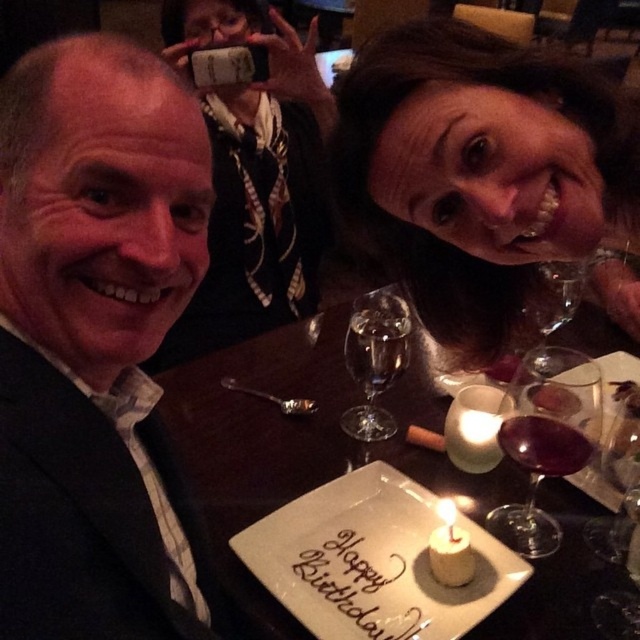
You are a waiter holding a tray of drinks. You need to place a new wine glass between the matte black suit at left and the translucent glass wine glass at center. Can you fit it there without moving the existing glass?

The distance between the matte black suit at left and the translucent glass wine glass at center is 42.97 centimeters. Assuming the new wine glass has a standard size of about 8 centimeters in diameter, there is sufficient space to place it between them without moving the existing glass.

You are a waiter in a restaurant. You need to serve a customer who ordered a drink in a glass with a larger width. Which glass should you choose between the dark red glass at center and the clear glass wine glass at upper right?

The clear glass wine glass at upper right has a larger width than the dark red glass at center, so you should choose the clear glass wine glass at upper right to serve the customer.

You are a waiter at this restaurant and need to place a dessert menu between the dark red glass at center and the clear glass wine glass at upper right. The dessert menu is 10 inches wide. Can you fit it between them without moving either glass?

The dark red glass at center is 10.16 inches from the clear glass wine glass at upper right. Since the dessert menu is 10 inches wide, it can fit between them as the distance is slightly more than the menu width.